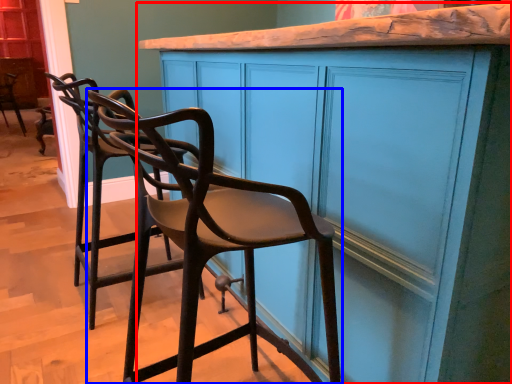
Question: Which object is further to the camera taking this photo, cabinetry (highlighted by a red box) or chair (highlighted by a blue box)?

Choices:
 (A) cabinetry
 (B) chair

Answer: (A)